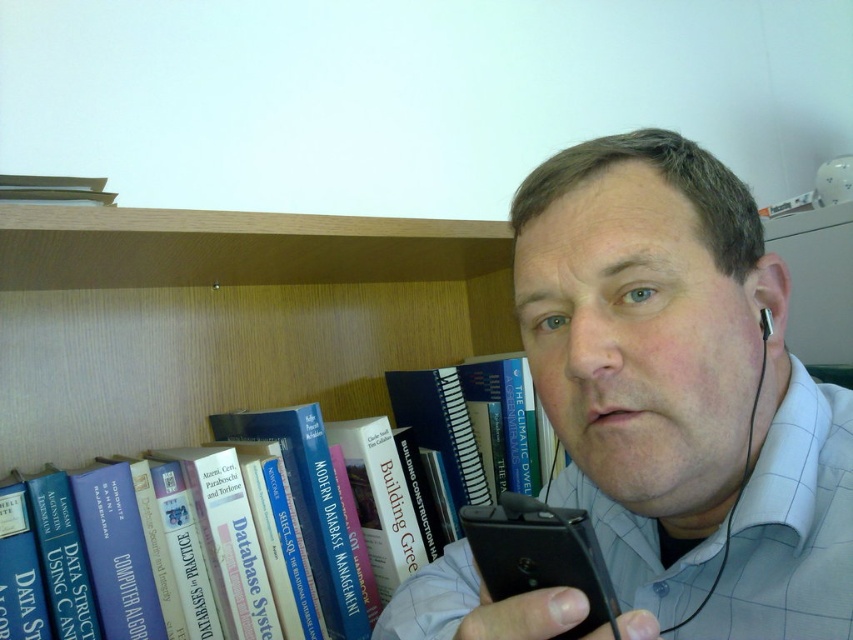
Does matte black phone at center have a lesser width compared to blue hardcover book at left?

Indeed, matte black phone at center has a lesser width compared to blue hardcover book at left.

Can you confirm if matte black phone at center is wider than blue hardcover book at left?

No, matte black phone at center is not wider than blue hardcover book at left.

Identify the location of matte black phone at center. tap(682, 392).

Who is more forward, (672, 321) or (766, 321)?

Point (672, 321) is more forward.

Is point (718, 161) more distant than point (766, 314)?

Yes, it is.

Is point (750, 378) less distant than point (761, 316)?

Yes, point (750, 378) is in front of point (761, 316).

Where is `matte black phone at center`? The width and height of the screenshot is (853, 640). matte black phone at center is located at coordinates (682, 392).

Who is more forward, [585,548] or [766,308]?

Point [585,548] is more forward.

Who is more distant from viewer, [587,612] or [764,337]?

Point [764,337]

The image size is (853, 640). I want to click on black plastic smartphone at lower center, so click(x=540, y=554).

Locate an element on the screen. The width and height of the screenshot is (853, 640). black plastic smartphone at lower center is located at coordinates (540, 554).